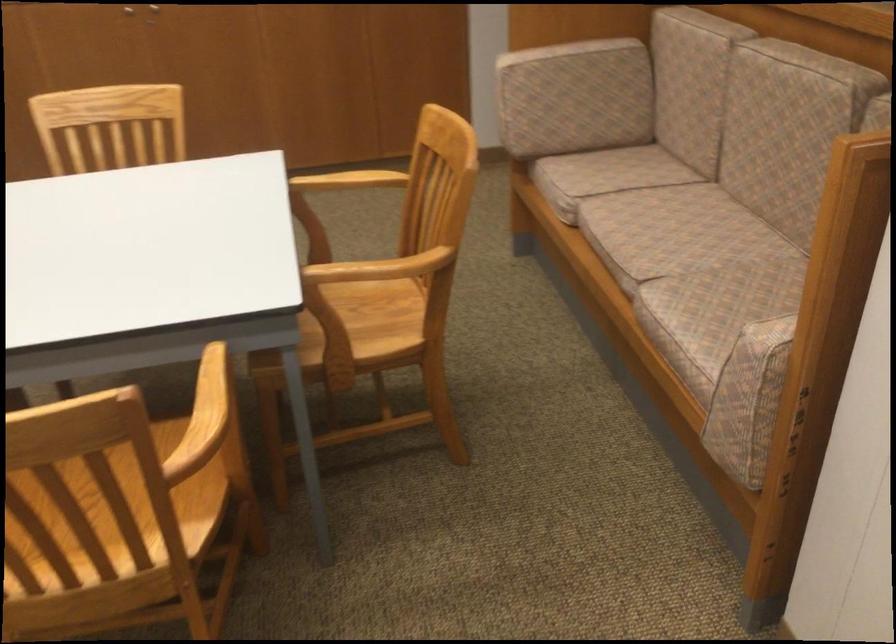
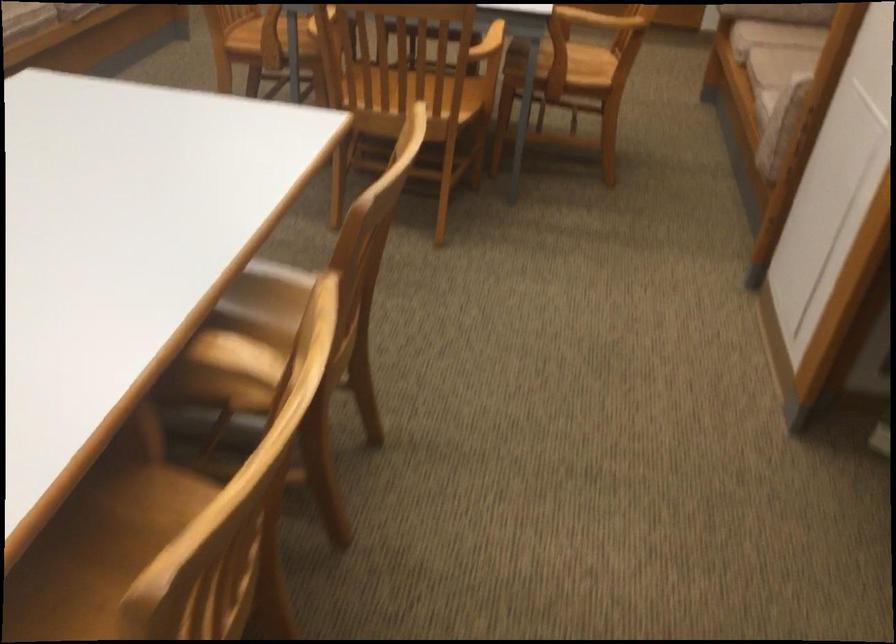
Question: What movement of the cameraman would produce the second image?

Choices:
 (A) Left
 (B) Right
 (C) Forward
 (D) Backward

Answer: (D)